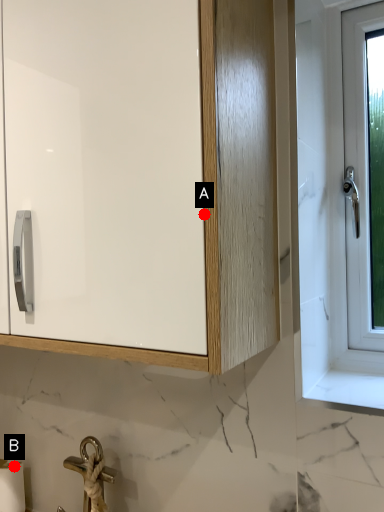
Question: Two points are circled on the image, labeled by A and B beside each circle. Which point is closer to the camera?

Choices:
 (A) A is closer
 (B) B is closer

Answer: (A)